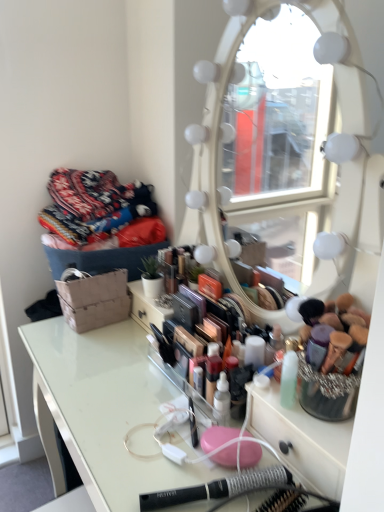
The height and width of the screenshot is (512, 384). I want to click on unoccupied area behind black plastic hairbrush at lower center, so click(x=181, y=431).